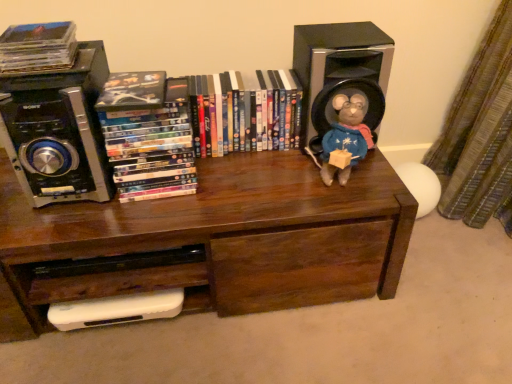
Question: Considering the relative sizes of black plastic speaker at upper left, arranged as the first speaker when viewed from the left, and fuzzy fabric stuffed animal at upper right in the image provided, is black plastic speaker at upper left, arranged as the first speaker when viewed from the left, smaller than fuzzy fabric stuffed animal at upper right?

Choices:
 (A) yes
 (B) no

Answer: (B)

Question: Can you confirm if black plastic speaker at upper left, arranged as the first speaker when viewed from the left, is wider than fuzzy fabric stuffed animal at upper right?

Choices:
 (A) yes
 (B) no

Answer: (A)

Question: Is black plastic speaker at upper left, arranged as the first speaker when viewed from the left, to the right of fuzzy fabric stuffed animal at upper right from the viewer's perspective?

Choices:
 (A) no
 (B) yes

Answer: (A)

Question: Is the depth of black plastic speaker at upper left, which ranks as the 2th speaker in right-to-left order, greater than that of fuzzy fabric stuffed animal at upper right?

Choices:
 (A) no
 (B) yes

Answer: (A)

Question: From a real-world perspective, is black plastic speaker at upper left, arranged as the first speaker when viewed from the left, positioned over fuzzy fabric stuffed animal at upper right based on gravity?

Choices:
 (A) yes
 (B) no

Answer: (A)

Question: Would you say black plastic speaker at upper left, which ranks as the 2th speaker in right-to-left order, is inside or outside black plastic speaker at upper right, arranged as the second speaker when viewed from the left?

Choices:
 (A) outside
 (B) inside

Answer: (A)

Question: Looking at their shapes, would you say black plastic speaker at upper left, arranged as the first speaker when viewed from the left, is wider or thinner than black plastic speaker at upper right, arranged as the second speaker when viewed from the left?

Choices:
 (A) wide
 (B) thin

Answer: (A)

Question: Is point (6, 109) positioned closer to the camera than point (306, 82)?

Choices:
 (A) closer
 (B) farther

Answer: (A)

Question: Based on their positions, is black plastic speaker at upper left, which ranks as the 2th speaker in right-to-left order, located to the left or right of black plastic speaker at upper right, which is counted as the first speaker, starting from the right?

Choices:
 (A) left
 (B) right

Answer: (A)

Question: Which is correct: matte plastic dvds at left, positioned as the second book in left-to-right order, is inside matte black compact disc at upper left, the 1th book when ordered from left to right, or outside of it?

Choices:
 (A) inside
 (B) outside

Answer: (B)

Question: From a real-world perspective, is matte plastic dvds at left, positioned as the 2th book in right-to-left order, physically located above or below matte black compact disc at upper left, the 3th book positioned from the right?

Choices:
 (A) above
 (B) below

Answer: (B)

Question: From the image's perspective, is matte plastic dvds at left, positioned as the 2th book in right-to-left order, located above or below matte black compact disc at upper left, the 3th book positioned from the right?

Choices:
 (A) below
 (B) above

Answer: (A)

Question: Considering the positions of matte plastic dvds at left, positioned as the second book in left-to-right order, and matte black compact disc at upper left, the 3th book positioned from the right, in the image, is matte plastic dvds at left, positioned as the second book in left-to-right order, wider or thinner than matte black compact disc at upper left, the 3th book positioned from the right,?

Choices:
 (A) wide
 (B) thin

Answer: (A)

Question: Is point (173, 170) positioned closer to the camera than point (376, 44)?

Choices:
 (A) closer
 (B) farther

Answer: (A)

Question: Based on their sizes in the image, would you say matte plastic dvds at left, positioned as the 2th book in right-to-left order, is bigger or smaller than black plastic speaker at upper right, which is counted as the first speaker, starting from the right?

Choices:
 (A) small
 (B) big

Answer: (A)